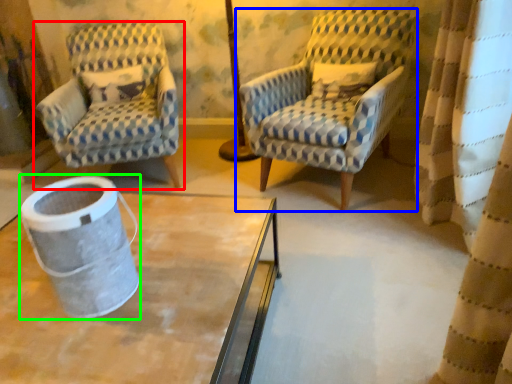
Question: Estimate the real-world distances between objects in this image. Which object is farther from chair (highlighted by a red box), chair (highlighted by a blue box) or gray (highlighted by a green box)?

Choices:
 (A) chair
 (B) gray

Answer: (B)